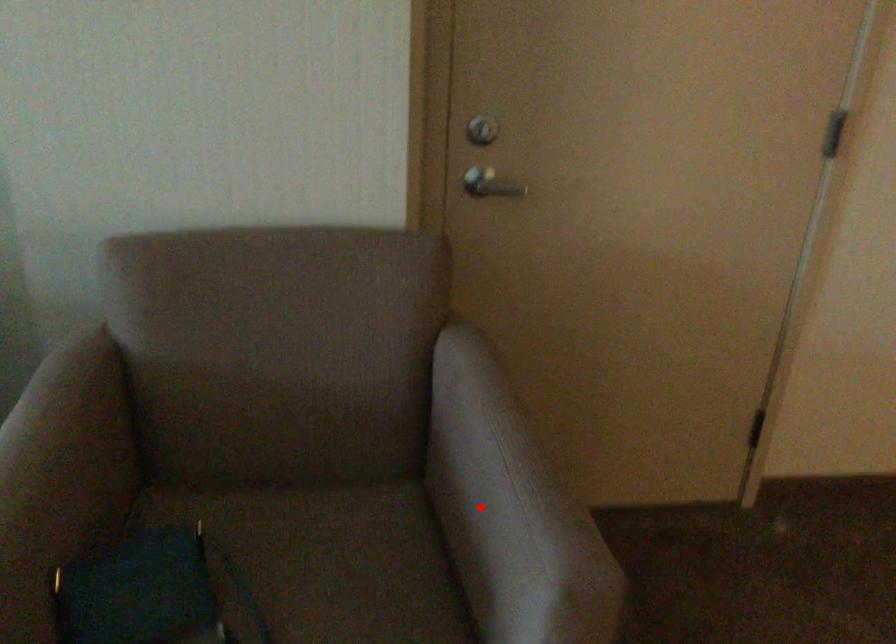
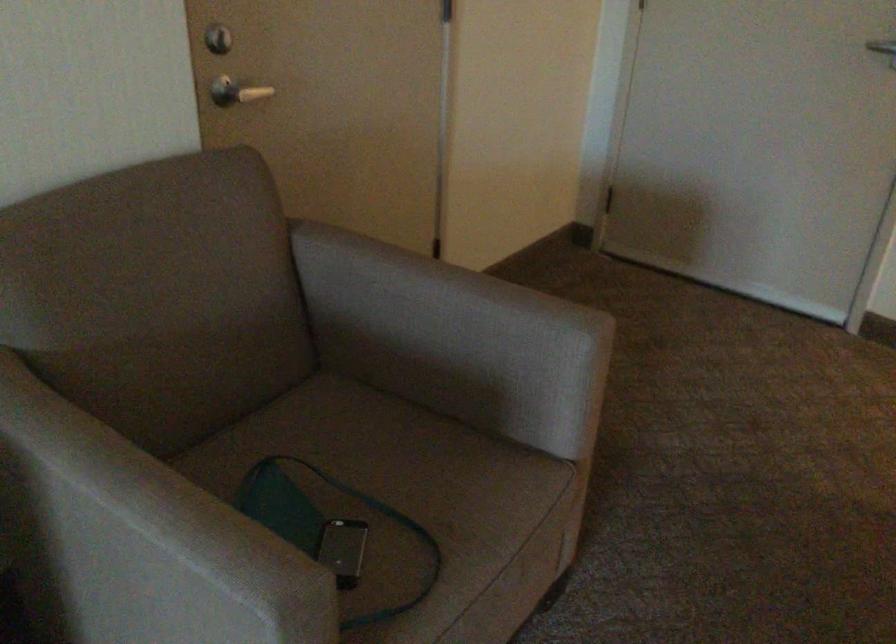
Question: I am providing you with two images of the same scene from different viewpoints. A red point is shown in image1. For the corresponding object point in image2, is it positioned nearer or farther from the camera?

Choices:
 (A) Nearer
 (B) Farther

Answer: (B)